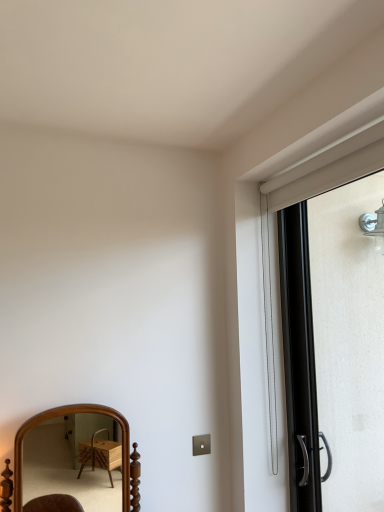
At what (x,y) coordinates should I click in order to perform the action: click on wooden mirror at lower left. Please return your answer as a coordinate pair (x, y). Looking at the image, I should click on (73, 461).

The height and width of the screenshot is (512, 384). What do you see at coordinates (73, 461) in the screenshot?
I see `wooden mirror at lower left` at bounding box center [73, 461].

What is the approximate width of black metallic screen door at right?

black metallic screen door at right is 3.07 inches wide.

The width and height of the screenshot is (384, 512). I want to click on black metallic screen door at right, so click(x=334, y=348).

What do you see at coordinates (334, 348) in the screenshot? This screenshot has width=384, height=512. I see `black metallic screen door at right` at bounding box center [334, 348].

Locate an element on the screen. This screenshot has width=384, height=512. wooden mirror at lower left is located at coordinates (73, 461).

Is black metallic screen door at right at the right side of wooden mirror at lower left?

Yes.

Does black metallic screen door at right come in front of wooden mirror at lower left?

Yes, it is.

Does point (322, 441) come behind point (76, 428)?

No, it is not.

From the image's perspective, is black metallic screen door at right below wooden mirror at lower left?

No, from the image's perspective, black metallic screen door at right is not beneath wooden mirror at lower left.

From a real-world perspective, is black metallic screen door at right located beneath wooden mirror at lower left?

Actually, black metallic screen door at right is physically above wooden mirror at lower left in the real world.

Which of these two, black metallic screen door at right or wooden mirror at lower left, is wider?

wooden mirror at lower left.

Considering the sizes of objects black metallic screen door at right and wooden mirror at lower left in the image provided, who is taller, black metallic screen door at right or wooden mirror at lower left?

With more height is black metallic screen door at right.

Considering the relative sizes of black metallic screen door at right and wooden mirror at lower left in the image provided, is black metallic screen door at right bigger than wooden mirror at lower left?

No.

Can we say black metallic screen door at right lies outside wooden mirror at lower left?

Yes.

Are black metallic screen door at right and wooden mirror at lower left far apart?

Yes, black metallic screen door at right and wooden mirror at lower left are quite far apart.

Is black metallic screen door at right positioned with its back to wooden mirror at lower left?

black metallic screen door at right is not turned away from wooden mirror at lower left.

Locate an element on the screen. The width and height of the screenshot is (384, 512). screen door on the right of wooden mirror at lower left is located at coordinates (334, 348).

Considering the relative positions of wooden mirror at lower left and black metallic screen door at right in the image provided, is wooden mirror at lower left to the left of black metallic screen door at right from the viewer's perspective?

Yes, wooden mirror at lower left is to the left of black metallic screen door at right.

Is wooden mirror at lower left further to camera compared to black metallic screen door at right?

That is True.

Which is further, (48,462) or (381,446)?

The point (48,462) is farther from the camera.

From the image's perspective, relative to black metallic screen door at right, is wooden mirror at lower left above or below?

Based on their image positions, wooden mirror at lower left is located beneath black metallic screen door at right.

From a real-world perspective, does wooden mirror at lower left sit lower than black metallic screen door at right?

Yes.

Which of these two, wooden mirror at lower left or black metallic screen door at right, is thinner?

With smaller width is black metallic screen door at right.

Can you confirm if wooden mirror at lower left is shorter than black metallic screen door at right?

Yes, wooden mirror at lower left is shorter than black metallic screen door at right.

Considering the sizes of objects wooden mirror at lower left and black metallic screen door at right in the image provided, who is smaller, wooden mirror at lower left or black metallic screen door at right?

Smaller between the two is black metallic screen door at right.

Is wooden mirror at lower left inside or outside of black metallic screen door at right?

wooden mirror at lower left is outside black metallic screen door at right.

Is wooden mirror at lower left positioned far away from black metallic screen door at right?

wooden mirror at lower left is far away from black metallic screen door at right.

Is wooden mirror at lower left positioned with its back to black metallic screen door at right?

No, wooden mirror at lower left is not facing away from black metallic screen door at right.

What's the angular difference between wooden mirror at lower left and black metallic screen door at right's facing directions?

They differ by 89.7 degrees in their facing directions.

Locate an element on the screen. screen door in front of the wooden mirror at lower left is located at coordinates (334, 348).

Identify the location of screen door positioned vertically above the wooden mirror at lower left (from a real-world perspective). (334, 348).

This screenshot has width=384, height=512. Identify the location of screen door on the right side of wooden mirror at lower left. (334, 348).